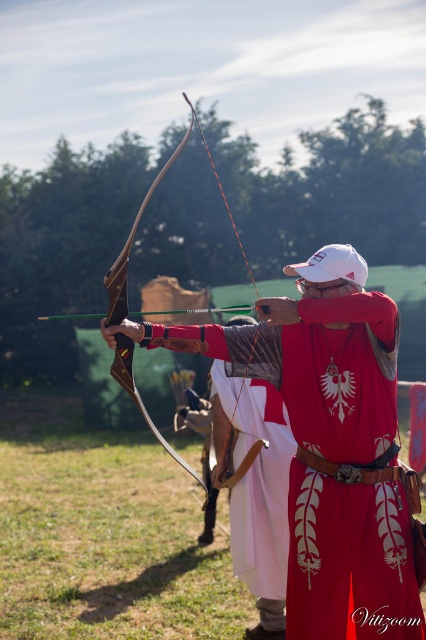
You are an archery instructor observing a student holding two bows, the leather bow at center and the wooden bow at center. Which bow should the student choose if they need a larger bow for better stability?

The wooden bow at center is larger than the leather bow at center, so the student should choose the wooden bow at center for better stability.

You are an archer aiming at a target. You notice two points in your field of view. The first point is at coordinate point(377, 355) and the second is at point(210, 515). Which point is closer to you?

Point(377, 355) is in front of point(210, 515), so it is closer to you.

You are an archery instructor observing a student preparing to shoot. The student is holding two bows, the leather bow at center and the wooden bow at center. You need to check if there is enough space between them for the student to comfortably draw the arrow. The minimum required space for safe drawing is 2 meters. Is the current distance sufficient?

The leather bow at center and wooden bow at center are 1.91 meters apart, which is less than the required 2 meters. Therefore, the current distance is not sufficient for safe drawing.